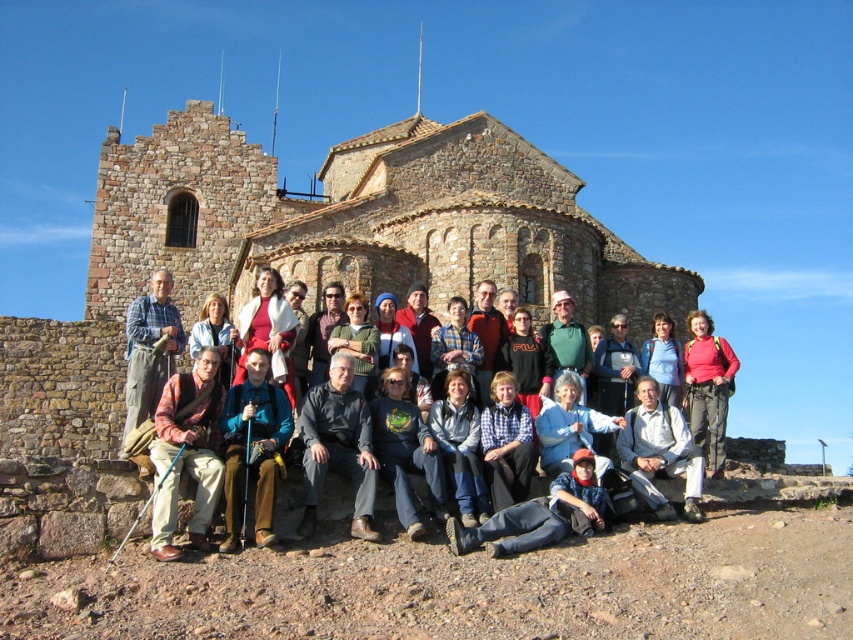
You are a photographer trying to frame a shot of the plaid fabric shirt at center and the blue fabric backpack at center. Which object is wider in the image?

The plaid fabric shirt at center is wider than the blue fabric backpack at center.

You are standing at the origin point of the coordinate system in the image. You want to locate the dark gray fabric jacket at center. In which direction should you move relative to your current position?

The dark gray fabric jacket at center is located at coordinate point (338,445), so you should move northeast to reach it.

You are a photographer trying to ensure everyone is visible in the photo. The dark gray fabric jacket at center and the matte red jacket at right are in the frame. Which jacket is shorter in height?

The dark gray fabric jacket at center is not as tall as the matte red jacket at right, so the dark gray fabric jacket at center is shorter in height.